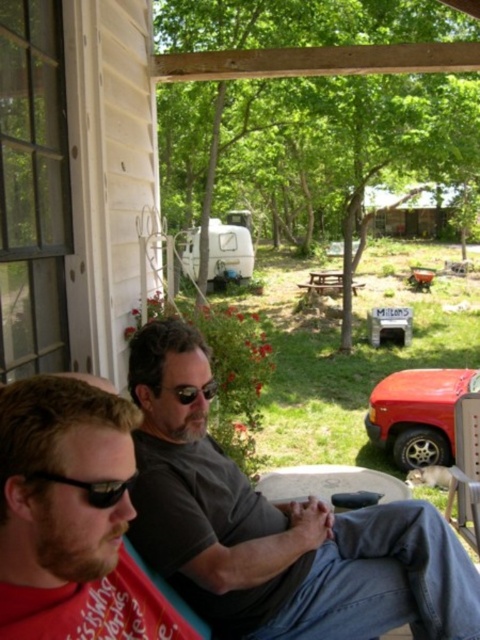
You are standing on the porch and want to pick up the black plastic sunglasses at lower left. Where exactly should you look to find them?

You should look at point (x=90, y=486) to find the black plastic sunglasses at lower left.

You are sitting on the porch swing and want to grab your sunglasses which are either the black plastic sunglasses at lower left or the black reflective sunglasses at center. Which pair is closer to your left hand?

The black plastic sunglasses at lower left are to the left of the black reflective sunglasses at center, so the black plastic sunglasses at lower left is closer to your left hand.